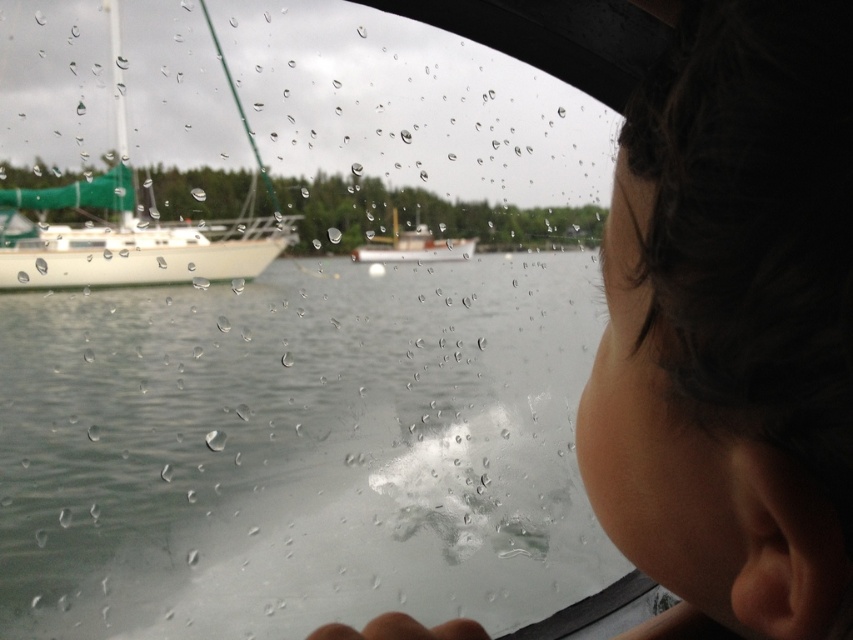
Question: Which point appears closest to the camera in this image?

Choices:
 (A) (231, 237)
 (B) (407, 244)
 (C) (160, 376)

Answer: (C)

Question: Based on their relative distances, which object is farther from the white matte sailboat at left?

Choices:
 (A) dark brown hair at upper right
 (B) white matte boat at center
 (C) transparent glass water at center

Answer: (A)

Question: Is transparent glass water at center smaller than white matte boat at center?

Choices:
 (A) no
 (B) yes

Answer: (A)

Question: Which object appears farthest from the camera in this image?

Choices:
 (A) white matte sailboat at left
 (B) dark brown hair at upper right
 (C) transparent glass water at center

Answer: (C)

Question: Does dark brown hair at upper right appear over white matte boat at center?

Choices:
 (A) yes
 (B) no

Answer: (B)

Question: Can you confirm if dark brown hair at upper right is wider than white matte boat at center?

Choices:
 (A) yes
 (B) no

Answer: (B)